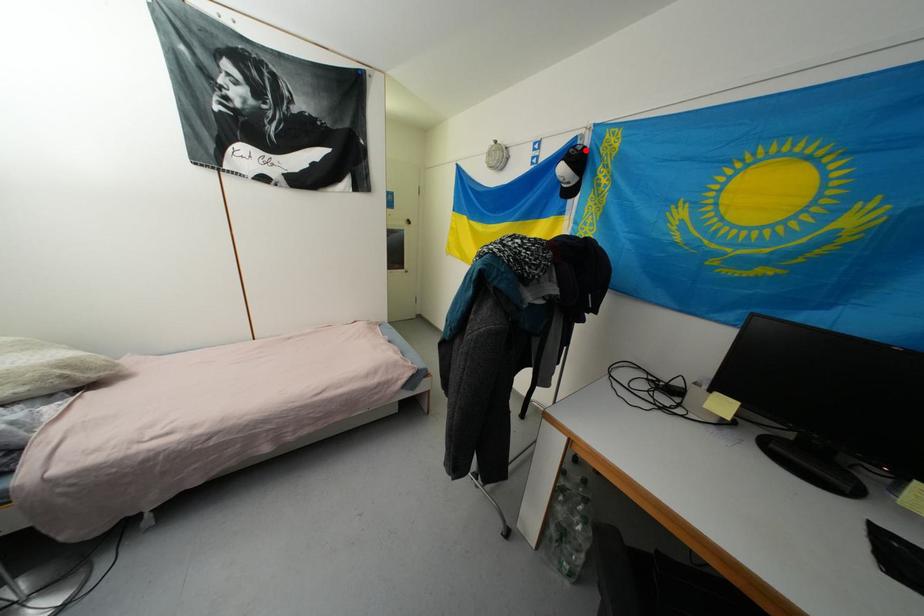
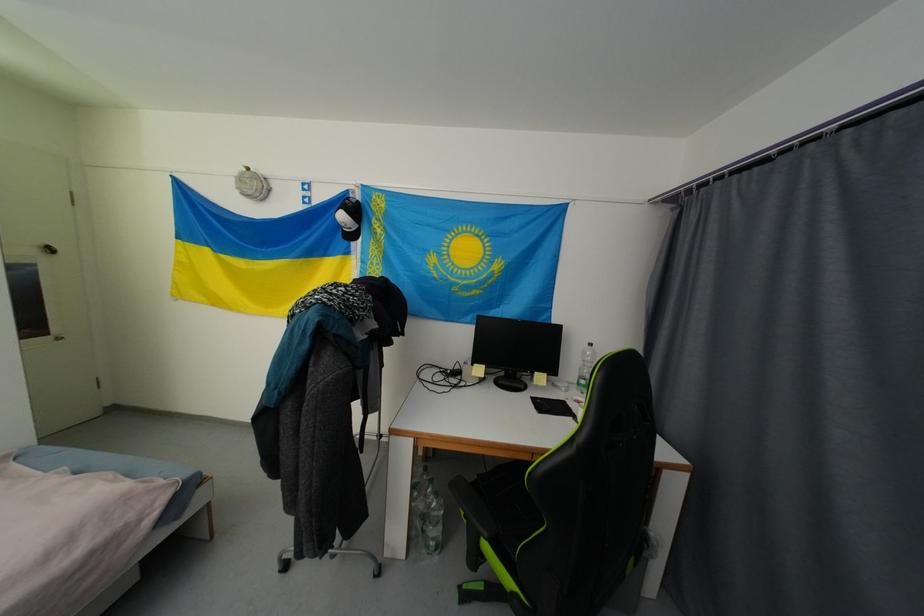
The point at the highlighted location is marked in the first image. Where is the corresponding point in the second image?

(359, 203)